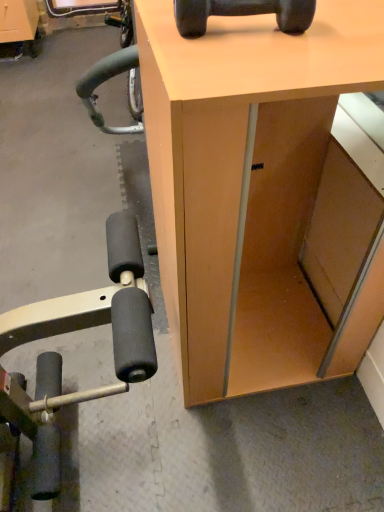
The width and height of the screenshot is (384, 512). Find the location of `free location in front of black rubber dumbbell at upper center`. free location in front of black rubber dumbbell at upper center is located at coordinates (251, 62).